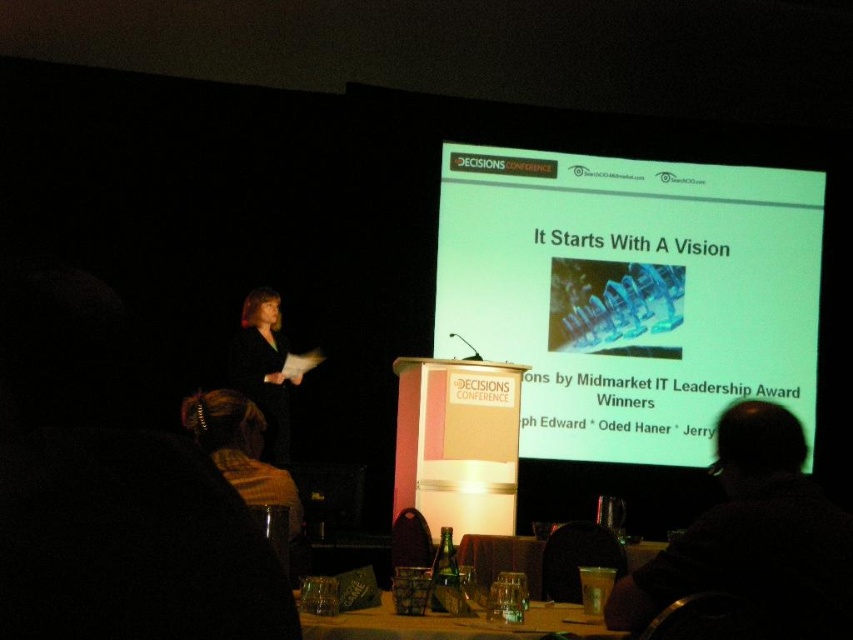
You are an event organizer setting up for a presentation. You have a brown knitted scarf at lower center and a translucent glass table at lower center. Which object is located to the left when viewed from the front of the stage?

The brown knitted scarf at lower center is positioned on the left side of the translucent glass table at lower center, so it is located to the left when viewed from the front of the stage.

You are sitting in the front row of the presentation. You need to reach the green matte projector screen at upper center to adjust the projection angle. Considering your height is 5 feet 6 inches, can you comfortably reach the screen without standing on something?

The green matte projector screen at upper center is 22.53 feet from viewer, which is too far away for you to reach comfortably from the front row without additional assistance. You would need to move closer or use a tool to adjust it.

You are an attendee at the conference and you want to take a photo of the presentation. The green matte projector screen at upper center and the black fabric at left are in your camera view. Which object should you focus on to capture the speaker and the projected content clearly?

The green matte projector screen at upper center is located above the black fabric at left, so focusing on the green matte projector screen at upper center would allow you to capture both the speaker and the projected content clearly as it is positioned higher and central in the scene.